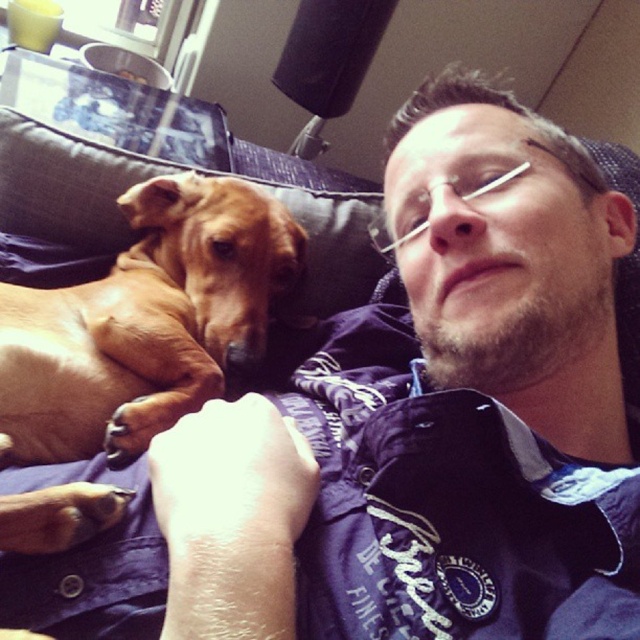
Based on the scene description, if you were standing in front of the couch, which object is positioned to the left of the other between the brown smooth dog at left and the brown fabric pillow at upper left?

The brown smooth dog at left is positioned to the left of the brown fabric pillow at upper left.

You are designing a new couch that needs to accommodate both the brown smooth dog at left and the brown fabric pillow at upper left. Based on their sizes, which one requires more space on the couch?

The brown smooth dog at left requires more space on the couch because it is larger in size than the brown fabric pillow at upper left.